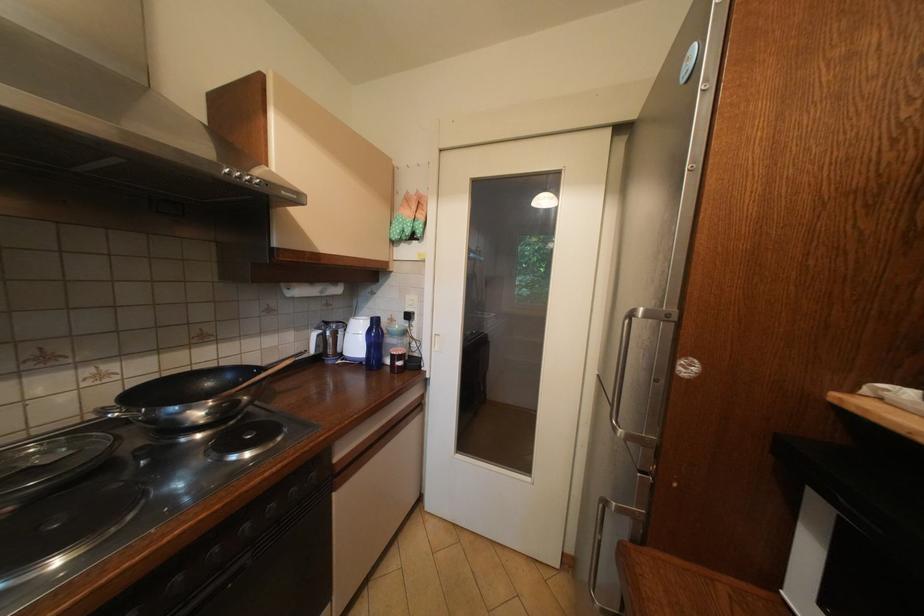
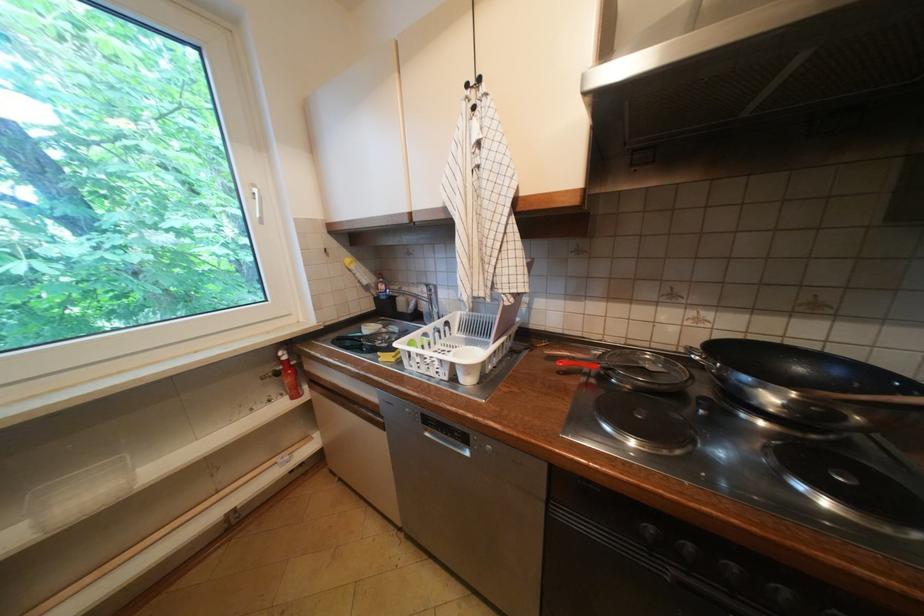
Question: The images are taken continuously from a first-person perspective. In which direction is your viewpoint rotating?

Choices:
 (A) Left
 (B) Right
 (C) Up
 (D) Down

Answer: (A)